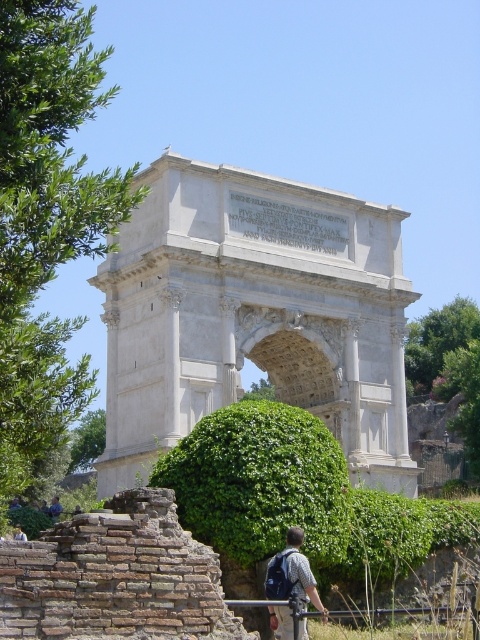
Question: Is white stone arch at center to the left of gray fabric backpack at lower center from the viewer's perspective?

Choices:
 (A) yes
 (B) no

Answer: (A)

Question: Which of these objects is positioned farthest from the light brown leather jacket at lower center?

Choices:
 (A) blue denim jeans at lower center
 (B) white stone arch at center

Answer: (B)

Question: Which object is positioned farthest from the white stone arch at center?

Choices:
 (A) light brown leather jacket at lower center
 (B) blue denim jeans at lower center
 (C) gray fabric backpack at lower center

Answer: (C)

Question: Can you confirm if gray fabric backpack at lower center is positioned below blue denim jeans at lower center?

Choices:
 (A) no
 (B) yes

Answer: (A)

Question: Does gray fabric backpack at lower center appear on the right side of blue denim jeans at lower center?

Choices:
 (A) no
 (B) yes

Answer: (B)

Question: Estimate the real-world distances between objects in this image. Which object is farther from the gray fabric backpack at lower center?

Choices:
 (A) white stone arch at center
 (B) blue denim jeans at lower center
 (C) light brown leather jacket at lower center

Answer: (B)